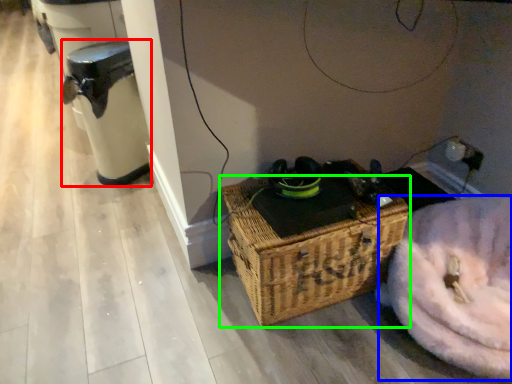
Question: Which object is positioned farthest from water heater (highlighted by a red box)? Select from washer (highlighted by a blue box) and picnic basket (highlighted by a green box).

Choices:
 (A) washer
 (B) picnic basket

Answer: (A)